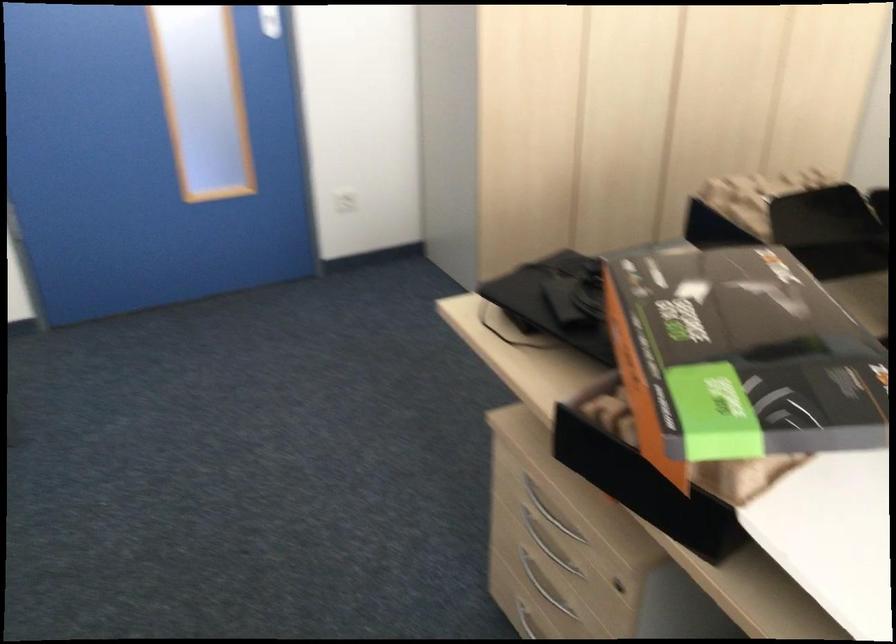
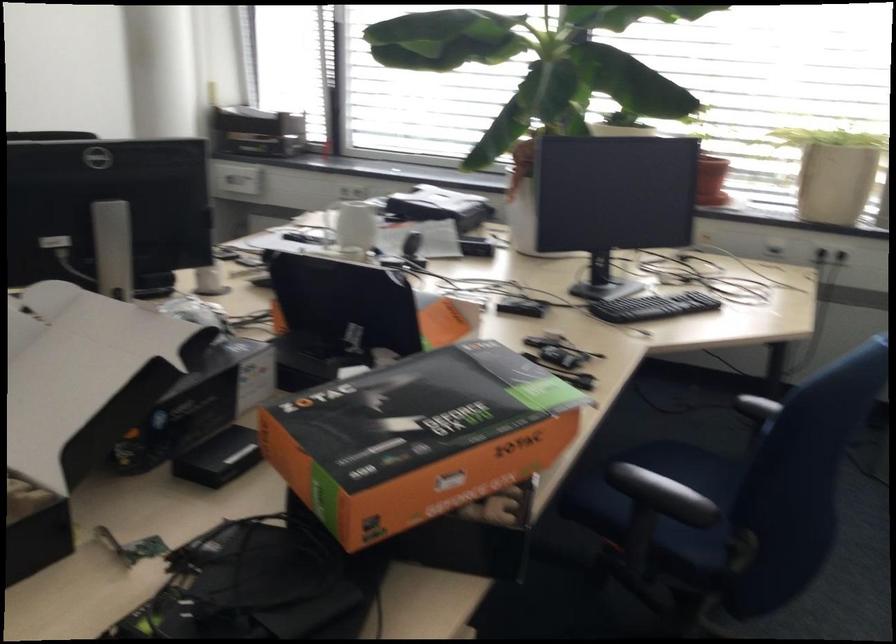
Locate, in the second image, the point that corresponds to point (711, 317) in the first image.

(399, 421)